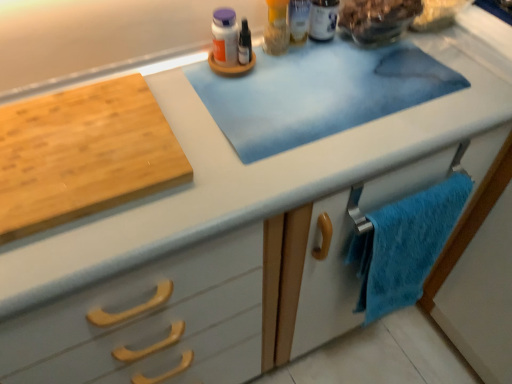
Locate an element on the screen. The height and width of the screenshot is (384, 512). free space in front of translucent plastic container at upper center, placed as the 1th toiletry when sorted from left to right is located at coordinates (275, 94).